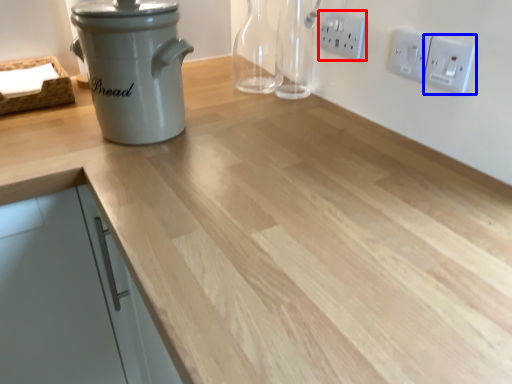
Question: Among these objects, which one is farthest to the camera, electric outlet (highlighted by a red box) or electric outlet (highlighted by a blue box)?

Choices:
 (A) electric outlet
 (B) electric outlet

Answer: (A)